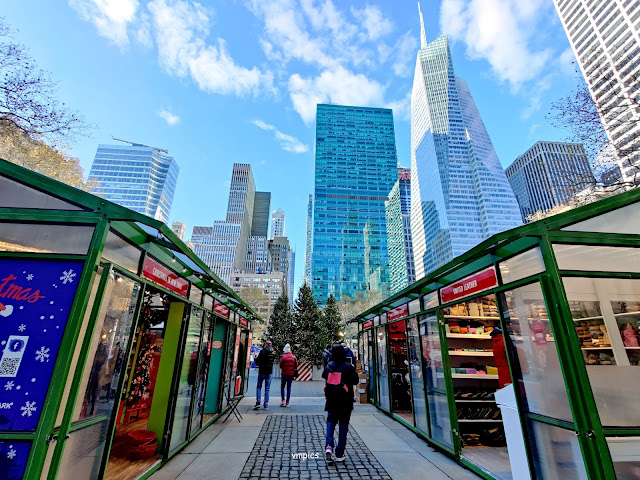
Where is `christmas tree`? The width and height of the screenshot is (640, 480). christmas tree is located at coordinates (139, 379).